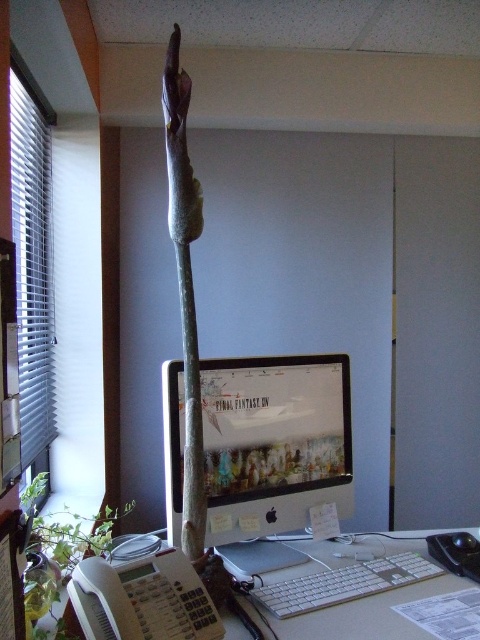
Is white plastic keyboard at center shorter than white plastic keyboard at lower center?

In fact, white plastic keyboard at center may be taller than white plastic keyboard at lower center.

Between white plastic keyboard at center and white plastic keyboard at lower center, which one has less height?

white plastic keyboard at lower center

Where is `white plastic keyboard at center`? white plastic keyboard at center is located at coordinates (367, 614).

Measure the distance between white plastic keyboard at lower center and green leafy plant at lower left.

The distance of white plastic keyboard at lower center from green leafy plant at lower left is 52.29 centimeters.

Does white plastic keyboard at lower center have a greater width compared to green leafy plant at lower left?

Correct, the width of white plastic keyboard at lower center exceeds that of green leafy plant at lower left.

Does point (348, 593) come in front of point (72, 518)?

Yes, point (348, 593) is in front of point (72, 518).

Where is `white plastic keyboard at lower center`? The image size is (480, 640). white plastic keyboard at lower center is located at coordinates (343, 582).

Does matte plastic monitor at center have a greater width compared to white plastic keyboard at lower center?

Yes.

Describe the element at coordinates (275, 442) in the screenshot. The height and width of the screenshot is (640, 480). I see `matte plastic monitor at center` at that location.

This screenshot has height=640, width=480. Find the location of `matte plastic monitor at center`. matte plastic monitor at center is located at coordinates (275, 442).